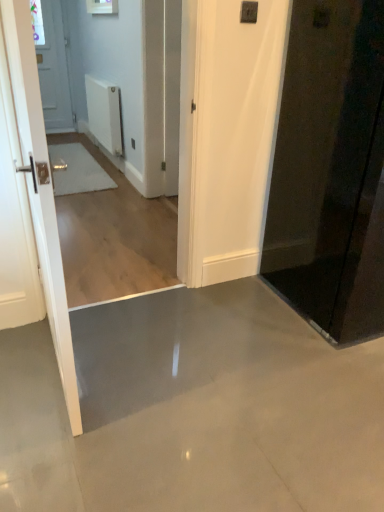
Question: Is white glossy door at left, arranged as the 2th door when viewed from the right, facing towards white matte radiator at upper center?

Choices:
 (A) yes
 (B) no

Answer: (B)

Question: Considering the relative positions of white glossy door at left, arranged as the 2th door when viewed from the right, and white matte radiator at upper center in the image provided, is white glossy door at left, arranged as the 2th door when viewed from the right, in front of white matte radiator at upper center?

Choices:
 (A) no
 (B) yes

Answer: (B)

Question: From the image's perspective, is white glossy door at left, arranged as the 1th door when viewed from the left, on white matte radiator at upper center?

Choices:
 (A) no
 (B) yes

Answer: (A)

Question: Can you confirm if white glossy door at left, arranged as the 2th door when viewed from the right, is thinner than white matte radiator at upper center?

Choices:
 (A) yes
 (B) no

Answer: (A)

Question: Can you confirm if white glossy door at left, arranged as the 1th door when viewed from the left, is bigger than white matte radiator at upper center?

Choices:
 (A) yes
 (B) no

Answer: (A)

Question: Does white glossy door at left, arranged as the 1th door when viewed from the left, appear on the left side of white matte radiator at upper center?

Choices:
 (A) no
 (B) yes

Answer: (A)

Question: Does black glossy door at right, the 2th door in the left-to-right sequence, turn towards white glossy door at left, arranged as the 2th door when viewed from the right?

Choices:
 (A) yes
 (B) no

Answer: (B)

Question: From a real-world perspective, is black glossy door at right, the first door in the right-to-left sequence, below white glossy door at left, arranged as the 2th door when viewed from the right?

Choices:
 (A) no
 (B) yes

Answer: (A)

Question: Is white glossy door at left, arranged as the 2th door when viewed from the right, located within black glossy door at right, the 2th door in the left-to-right sequence?

Choices:
 (A) yes
 (B) no

Answer: (B)

Question: Is black glossy door at right, the 2th door in the left-to-right sequence, next to white glossy door at left, arranged as the 1th door when viewed from the left, and touching it?

Choices:
 (A) yes
 (B) no

Answer: (B)

Question: From the image's perspective, is black glossy door at right, the first door in the right-to-left sequence, above white glossy door at left, arranged as the 1th door when viewed from the left?

Choices:
 (A) no
 (B) yes

Answer: (B)

Question: Is black glossy door at right, the first door in the right-to-left sequence, bigger than white glossy door at left, arranged as the 1th door when viewed from the left?

Choices:
 (A) yes
 (B) no

Answer: (A)

Question: Is black glossy door at right, the 2th door in the left-to-right sequence, looking in the opposite direction of white matte radiator at upper center?

Choices:
 (A) no
 (B) yes

Answer: (B)